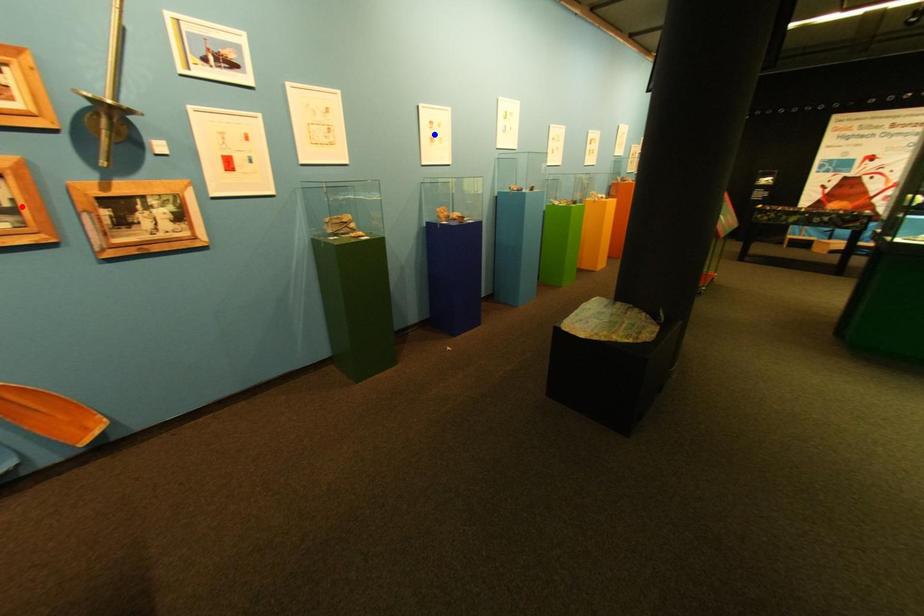
Question: In the image, two points are highlighted. Which point is nearer to the camera? Reply with the corresponding letter.

Choices:
 (A) blue point
 (B) red point

Answer: (B)